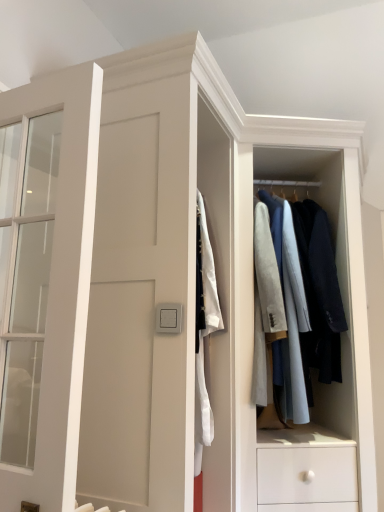
Question: In terms of height, does satin silver switch at center look taller or shorter compared to light gray fabric coat rack at center?

Choices:
 (A) short
 (B) tall

Answer: (A)

Question: In terms of width, does satin silver switch at center look wider or thinner when compared to light gray fabric coat rack at center?

Choices:
 (A) thin
 (B) wide

Answer: (A)

Question: Which is nearer to the matte white door at left?

Choices:
 (A) light gray fabric coat rack at center
 (B) satin silver switch at center

Answer: (B)

Question: Which is nearer to the light gray fabric coat rack at center?

Choices:
 (A) matte white door at left
 (B) satin silver switch at center

Answer: (B)